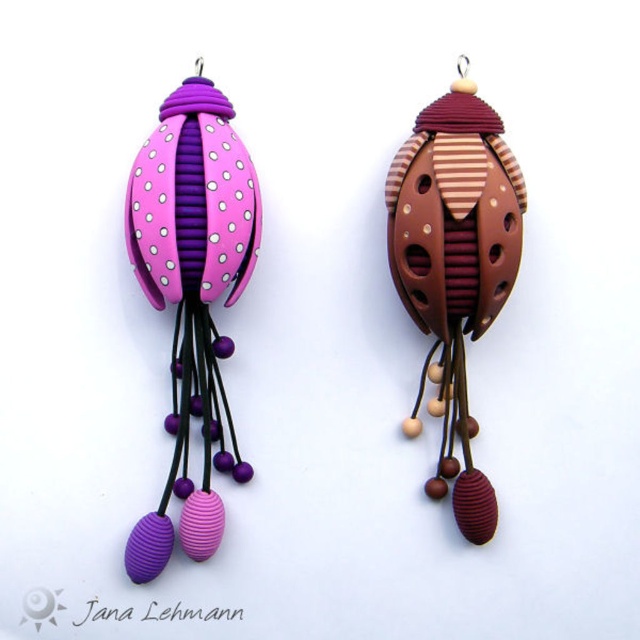
From the picture: You are a customer at a jewelry store looking at the matte purple polymer clay earring at left and the brown striped polymer clay earring at center. Which earring is taller?

The matte purple polymer clay earring at left is much taller than the brown striped polymer clay earring at center.

In the scene shown: Which object corresponds to the coordinates point [192,296] in the image?

The point [192,296] corresponds to the matte purple polymer clay earring at left.

You are a jeweler who needs to place both the matte purple polymer clay earring at left and the brown striped polymer clay earring at center into a display case that is 12 inches wide. Can both earrings fit side by side without overlapping?

The matte purple polymer clay earring at left and the brown striped polymer clay earring at center are 13.40 inches apart. Since the display case is only 12 inches wide, the total width required exceeds the available space. Therefore, they cannot fit side by side without overlapping.